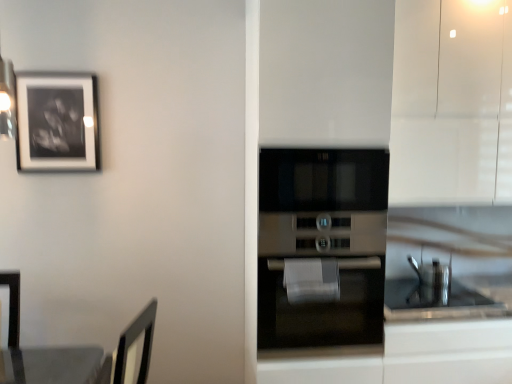
Question: From the image's perspective, is black matte picture frame at upper left positioned above or below stainless steel oven at center?

Choices:
 (A) above
 (B) below

Answer: (A)

Question: In the image, is black matte picture frame at upper left on the left side or the right side of stainless steel oven at center?

Choices:
 (A) left
 (B) right

Answer: (A)

Question: Which is farther from the black matte picture frame at upper left?

Choices:
 (A) white glossy cabinet at upper right
 (B) stainless steel oven at center

Answer: (A)

Question: Considering the real-world distances, which object is closest to the black matte picture frame at upper left?

Choices:
 (A) white glossy cabinet at upper right
 (B) stainless steel oven at center

Answer: (B)